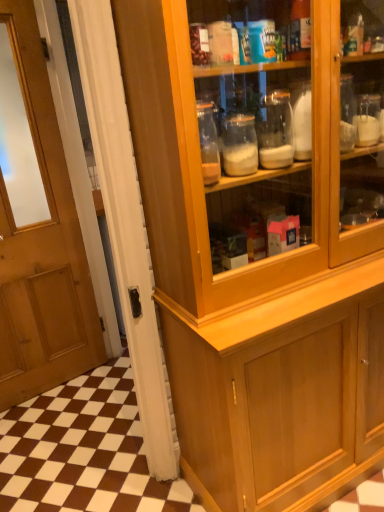
Locate an element on the screen. vacant space to the left of wooden door at left is located at coordinates (43, 486).